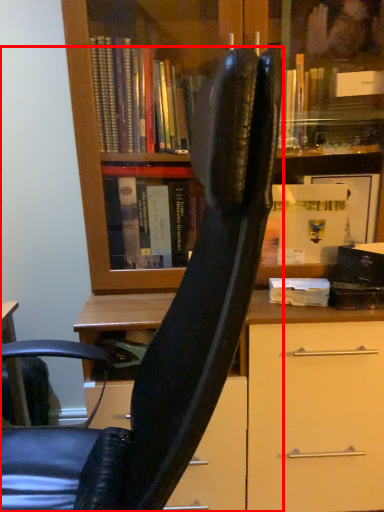
Question: From the image's perspective, what is the correct spatial positioning of chair (annotated by the red box) in reference to book?

Choices:
 (A) above
 (B) below

Answer: (B)